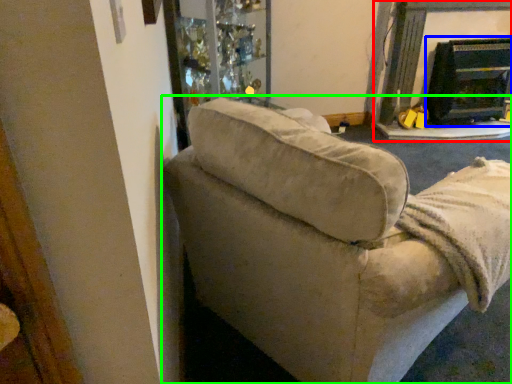
Question: Which object is the farthest from fireplace (highlighted by a red box)? Choose among these: fireplace (highlighted by a blue box) or studio couch (highlighted by a green box).

Choices:
 (A) fireplace
 (B) studio couch

Answer: (B)